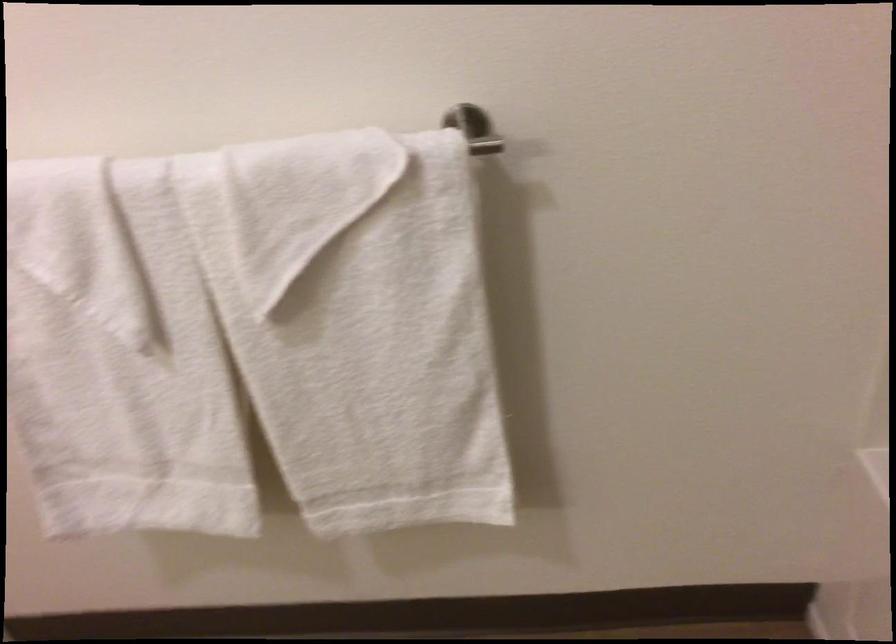
The first image is from the beginning of the video and the second image is from the end. How did the camera likely rotate when shooting the video?

The rotation direction of the camera is left-down.